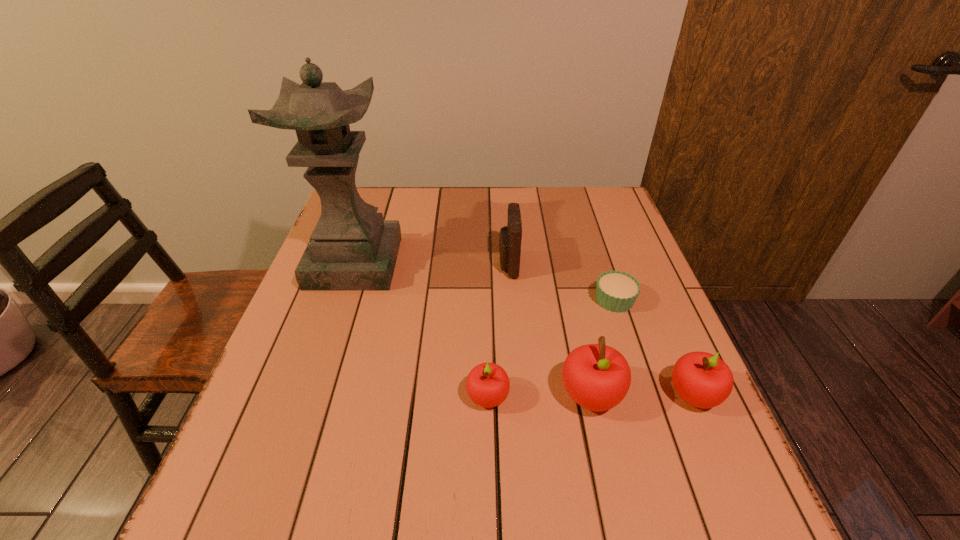
Find the location of a particular element. This screenshot has height=540, width=960. free space located on the front of the tallest apple is located at coordinates (607, 466).

Find the location of a particular element. This screenshot has height=540, width=960. vacant area situated on the left of the third shortest object is located at coordinates (633, 395).

I want to click on free space located 0.270m at the front opening of the leftmost object, so click(315, 380).

Identify the location of vacant space situated 0.060m with an open flap on the pouch. The height and width of the screenshot is (540, 960). (476, 265).

Where is `free space located with an open flap on the pouch`? This screenshot has height=540, width=960. free space located with an open flap on the pouch is located at coordinates (376, 265).

Identify the location of free point located 0.170m with an open flap on the pouch. Image resolution: width=960 pixels, height=540 pixels. (435, 265).

I want to click on free space located 0.100m on the front of the cupcake, so click(x=630, y=348).

This screenshot has height=540, width=960. I want to click on object that is positioned at the near edge, so click(x=597, y=377).

Locate an element on the screen. object located in the left edge section of the desktop is located at coordinates (351, 248).

The width and height of the screenshot is (960, 540). What are the coordinates of `cupcake at the right edge` in the screenshot? It's located at (616, 291).